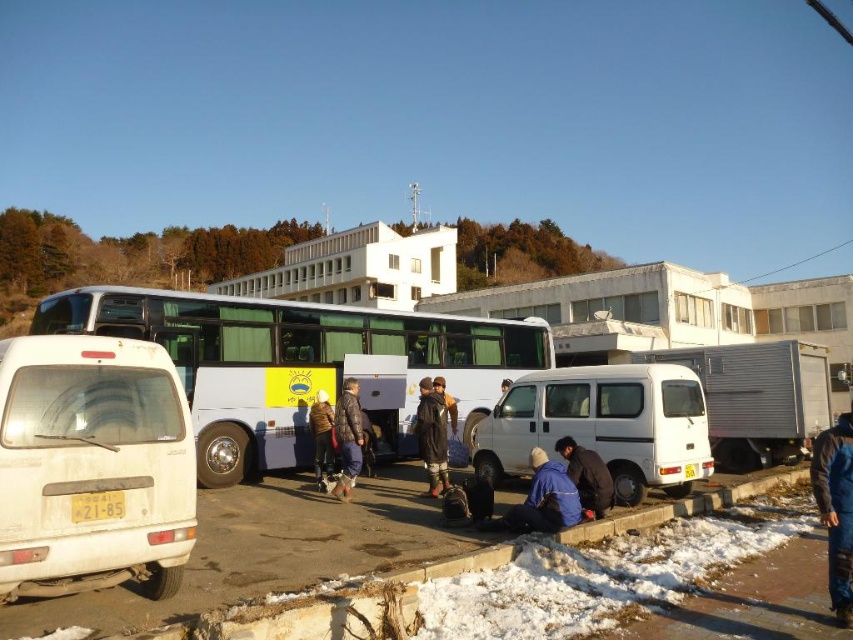
Can you confirm if white matte bus at center is shorter than white matte van at left?

No.

Between point (44, 317) and point (65, 582), which one is positioned behind?

Point (44, 317)

Is point (267, 387) farther from viewer compared to point (74, 440)?

Yes.

Where is `white matte bus at center`? white matte bus at center is located at coordinates (300, 364).

Between blue fabric jacket at lower center and dark blue puffer jacket at center, which one has more height?

With more height is dark blue puffer jacket at center.

I want to click on blue fabric jacket at lower center, so click(543, 499).

Find the location of a particular element. This screenshot has height=640, width=853. blue fabric jacket at lower center is located at coordinates (543, 499).

Can you confirm if white matte van at left is positioned to the left of dark blue jacket at lower center?

Indeed, white matte van at left is positioned on the left side of dark blue jacket at lower center.

At what (x,y) coordinates should I click in order to perform the action: click on white matte van at left. Please return your answer as a coordinate pair (x, y). Image resolution: width=853 pixels, height=640 pixels. Looking at the image, I should click on (91, 465).

Does point (169, 484) lie behind point (575, 444)?

No, (169, 484) is closer to viewer.

In order to click on white matte van at left in this screenshot , I will do coord(91,465).